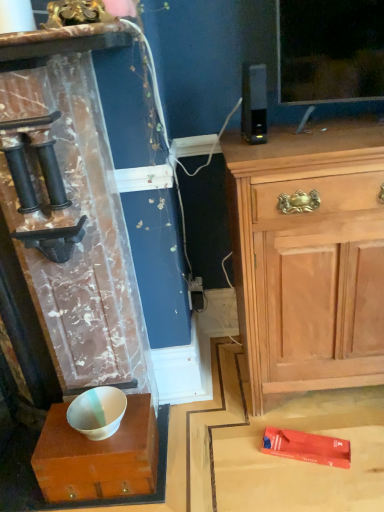
Question: In the image, is light wood cabinet at upper right on the left side or the right side of white glossy bowl at center?

Choices:
 (A) right
 (B) left

Answer: (A)

Question: Considering the positions of light wood cabinet at upper right and white glossy bowl at center in the image, is light wood cabinet at upper right wider or thinner than white glossy bowl at center?

Choices:
 (A) wide
 (B) thin

Answer: (A)

Question: Considering the real-world distances, which object is closest to the light wood cabinet at upper right?

Choices:
 (A) white glossy bowl at lower left
 (B) white glossy bowl at center

Answer: (B)

Question: Based on their relative distances, which object is nearer to the white glossy bowl at lower left?

Choices:
 (A) white glossy bowl at center
 (B) light wood cabinet at upper right

Answer: (A)